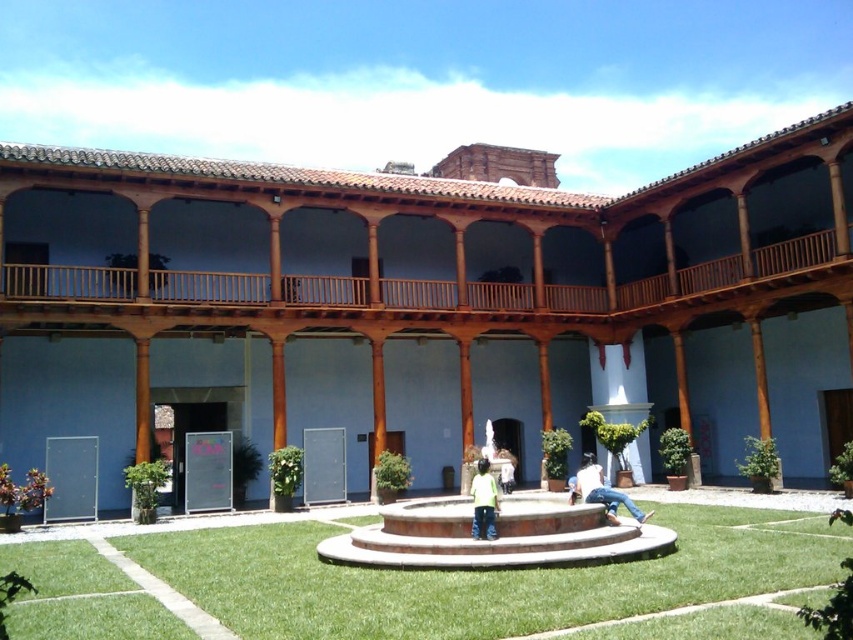
Is denim jeans at center to the right of green matte shirt at center from the viewer's perspective?

Indeed, denim jeans at center is positioned on the right side of green matte shirt at center.

Between denim jeans at center and green matte shirt at center, which one has more height?

With more height is green matte shirt at center.

Measure the distance between denim jeans at center and camera.

denim jeans at center is 91.61 feet away from camera.

Where is `denim jeans at center`? This screenshot has width=853, height=640. denim jeans at center is located at coordinates (602, 492).

Is brown stone fountain at center smaller than denim jeans at center?

Actually, brown stone fountain at center might be larger than denim jeans at center.

Is brown stone fountain at center above denim jeans at center?

Indeed, brown stone fountain at center is positioned over denim jeans at center.

Who is more forward, (608, 531) or (640, 516)?

Point (608, 531)

The height and width of the screenshot is (640, 853). What are the coordinates of `brown stone fountain at center` in the screenshot? It's located at (495, 536).

Image resolution: width=853 pixels, height=640 pixels. What are the coordinates of `green grass at center` in the screenshot? It's located at (480, 579).

From the picture: Can you confirm if green grass at center is positioned below green matte shirt at center?

Indeed, green grass at center is positioned under green matte shirt at center.

Who is more distant from viewer, [242,528] or [474,486]?

Point [242,528]

I want to click on green grass at center, so click(x=480, y=579).